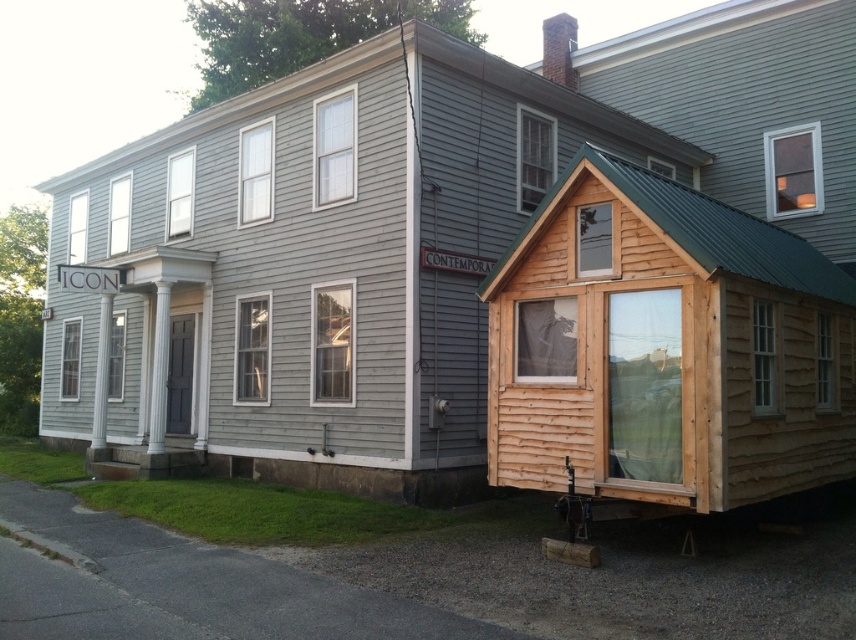
Who is more forward, (388, 492) or (718, 84)?

Point (388, 492) is more forward.

Is the position of natural wood cabin at right less distant than that of wooden cabin at upper right?

That is True.

Image resolution: width=856 pixels, height=640 pixels. In order to click on natural wood cabin at right in this screenshot , I will do `click(400, 234)`.

This screenshot has height=640, width=856. In order to click on natural wood cabin at right in this screenshot , I will do `click(400, 234)`.